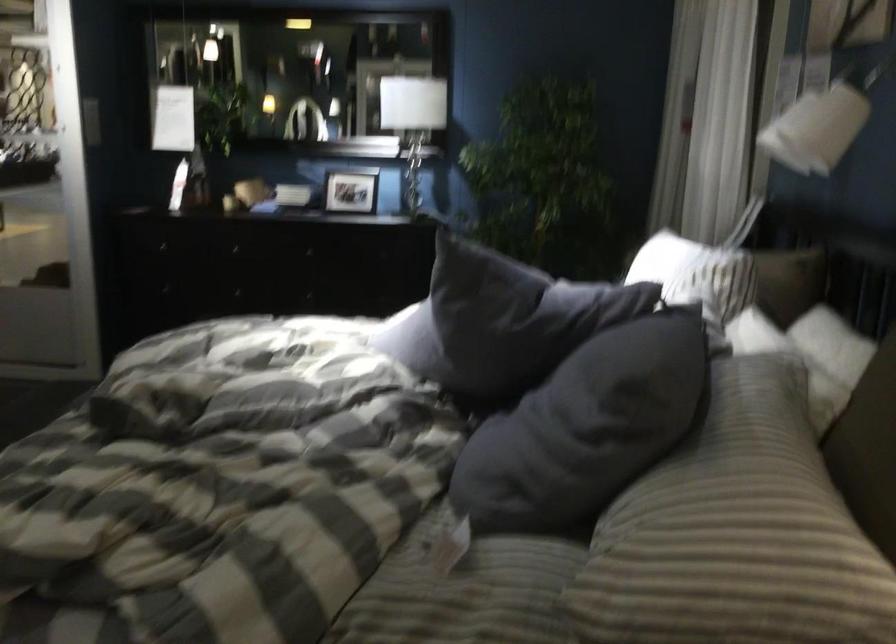
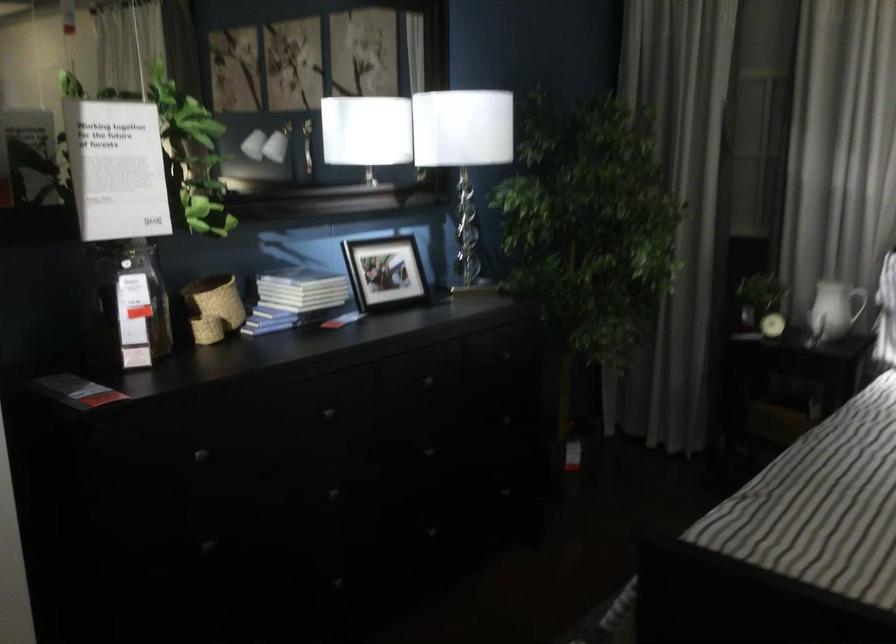
In the second image, find the point that corresponds to the point at 282,162 in the first image.

(300, 290)